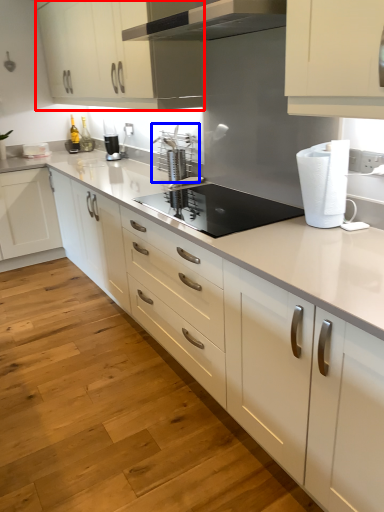
Question: Among these objects, which one is nearest to the camera, cabinetry (highlighted by a red box) or appliance (highlighted by a blue box)?

Choices:
 (A) cabinetry
 (B) appliance

Answer: (A)